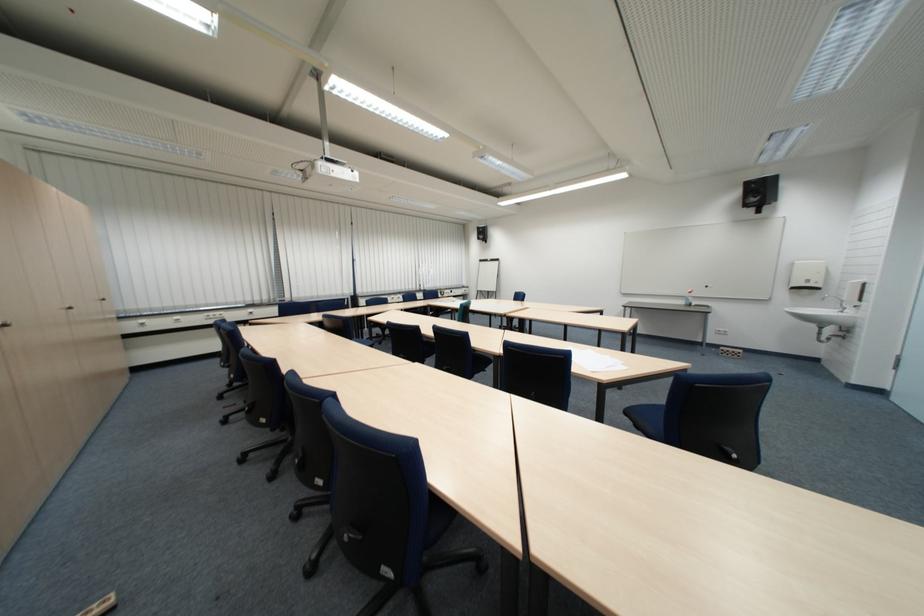
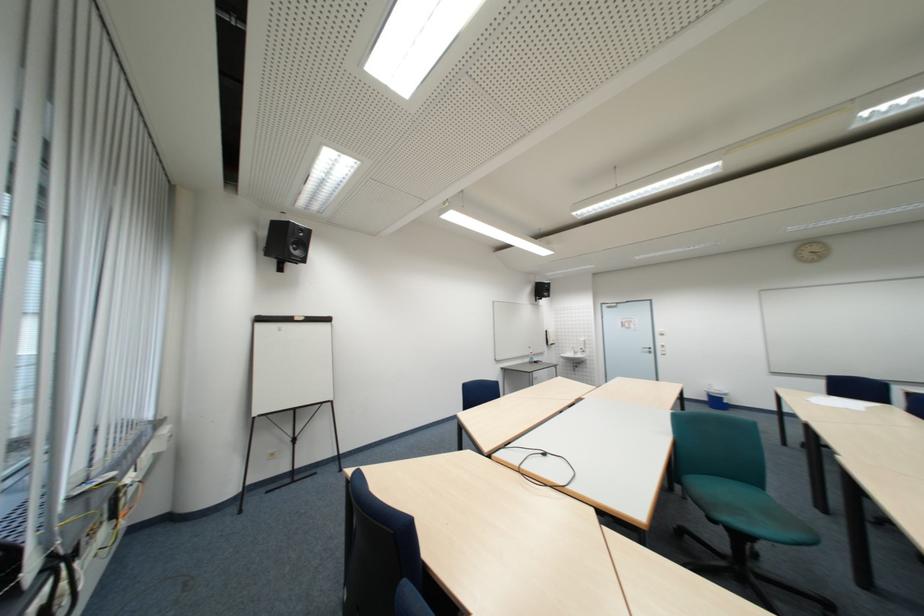
In the second image, find the point that corresponds to point (494, 262) in the first image.

(273, 321)